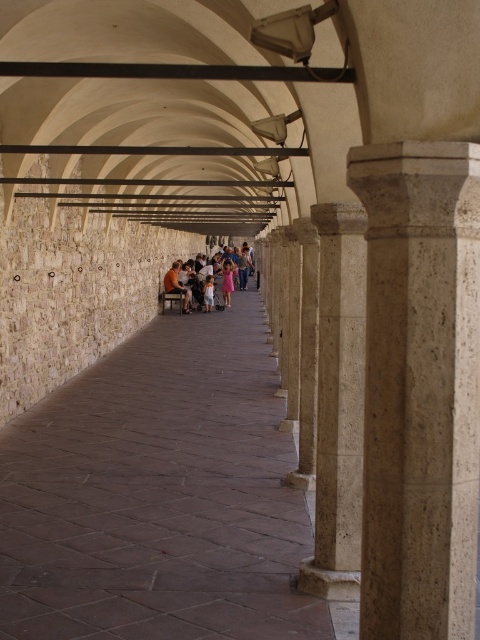
You are standing at the entrance of the walkway and see a pink fabric dress at center and a brown leather jacket at center. You want to pick up both items but can only move forward. Which item should you reach for first?

The pink fabric dress at center is closer to you than the brown leather jacket at center since it is only 2.18 meters away, so you should reach for the pink fabric dress at center first.

You are standing at the entrance of the walkway and notice the beige stone column at center and the brown leather jacket at center. Which object is located directly above the other?

The brown leather jacket at center is directly above the beige stone column at center because the beige stone column at center is positioned under the brown leather jacket at center.

You are standing at the entrance of the walkway and want to reach a bench located 20 feet away. The beige stone column at center is in your path. Can you walk around it to reach the bench?

The beige stone column at center is only 15.59 feet away from you, so you can easily walk around it to reach the bench located 20 feet away.